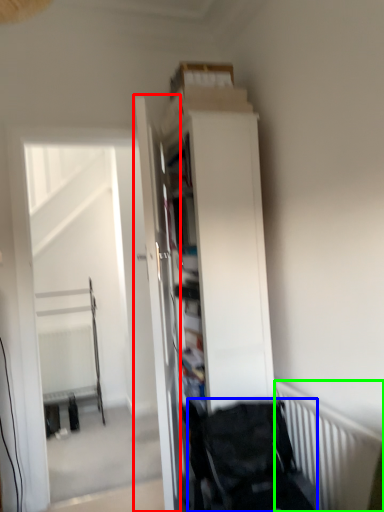
Question: Estimate the real-world distances between objects in this image. Which object is closer to door (highlighted by a red box), baby carriage (highlighted by a blue box) or radiator (highlighted by a green box)?

Choices:
 (A) baby carriage
 (B) radiator

Answer: (A)